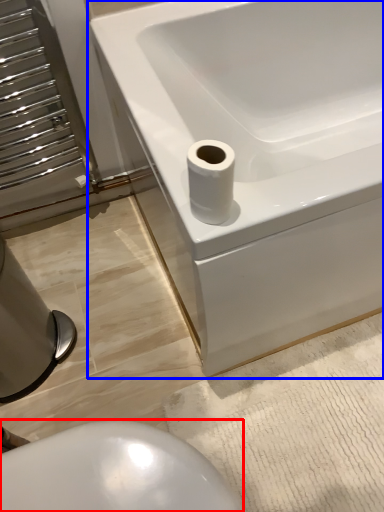
Question: Which object appears closest to the camera in this image, bidet (highlighted by a red box) or bathtub (highlighted by a blue box)?

Choices:
 (A) bidet
 (B) bathtub

Answer: (A)